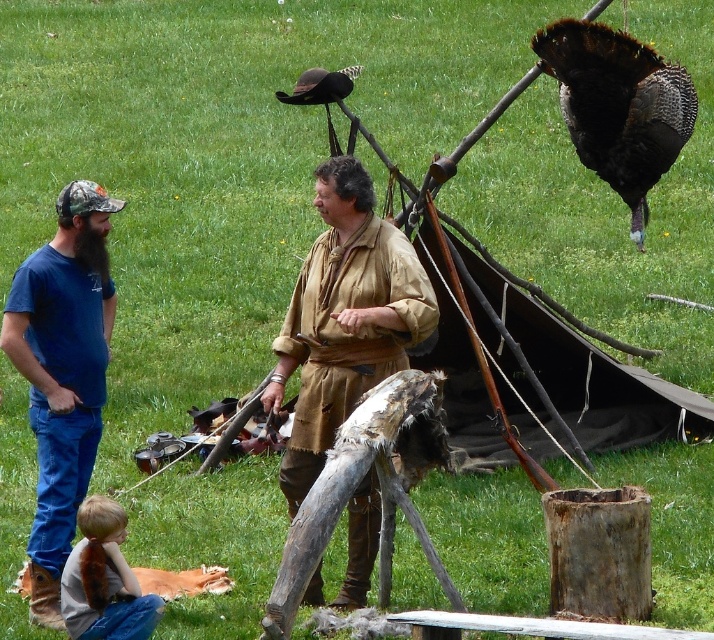
Who is more forward, (19, 289) or (638, 42)?

Point (19, 289) is in front.

This screenshot has width=714, height=640. What are the coordinates of `blue denim jeans at left` in the screenshot? It's located at (61, 372).

Measure the distance between point (618, 140) and camera.

Point (618, 140) is 12.12 meters from camera.

Is shiny black turkey at upper right above light brown hair at lower left?

Correct, shiny black turkey at upper right is located above light brown hair at lower left.

The image size is (714, 640). I want to click on shiny black turkey at upper right, so click(x=618, y=106).

Is the position of blue denim jeans at left less distant than that of light brown hair at lower left?

No, it is behind light brown hair at lower left.

Which is in front, point (74, 186) or point (76, 634)?

Positioned in front is point (76, 634).

You are a GUI agent. You are given a task and a screenshot of the screen. Output one action in this format:
    pyautogui.click(x=<x>, y=<y>)
    Task: Click on the blue denim jeans at left
    The height and width of the screenshot is (640, 714).
    Given the screenshot: What is the action you would take?
    pyautogui.click(x=61, y=372)

Where is `blue denim jeans at left`? blue denim jeans at left is located at coordinates (61, 372).